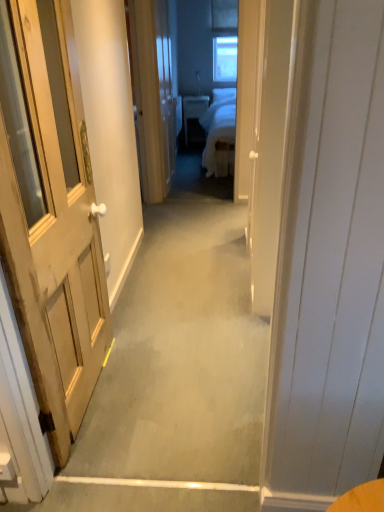
Question: In terms of height, does clear glass window at upper center look taller or shorter compared to wooden door at left?

Choices:
 (A) short
 (B) tall

Answer: (A)

Question: In terms of size, does clear glass window at upper center appear bigger or smaller than wooden door at left?

Choices:
 (A) big
 (B) small

Answer: (B)

Question: Which is nearer to the clear glass window at upper center?

Choices:
 (A) carpeted hallway at center
 (B) wooden door at left

Answer: (A)

Question: Which object is the closest to the carpeted hallway at center?

Choices:
 (A) wooden door at left
 (B) clear glass window at upper center

Answer: (A)